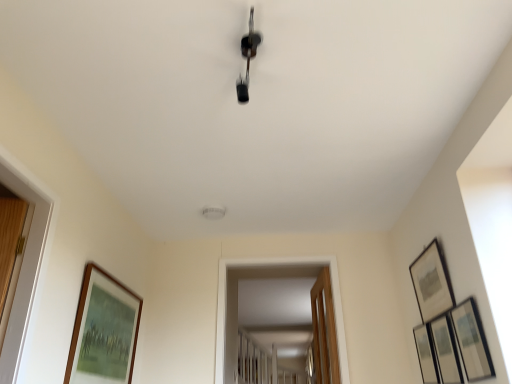
How much space does metallic silver picture frame at right, the first picture frame from the right, occupy horizontally?

The width of metallic silver picture frame at right, the first picture frame from the right, is 1.19 inches.

Describe the element at coordinates (103, 330) in the screenshot. Image resolution: width=512 pixels, height=384 pixels. I see `wooden-framed painting at lower left, acting as the 1th picture frame starting from the left` at that location.

I want to click on wooden door at center, so [x=324, y=331].

Locate an element on the screen. The image size is (512, 384). metallic silver picture frame at right, the first picture frame from the right is located at coordinates (426, 354).

Could you tell me if wooden framed picture at right, which is the fourth picture frame from left to right, is facing matte black picture frame at upper right, which appears as the third picture frame when viewed from the left?

No, wooden framed picture at right, which is the fourth picture frame from left to right, does not turn towards matte black picture frame at upper right, which appears as the third picture frame when viewed from the left.

Locate an element on the screen. picture frame that is the 3rd one when counting downward from the matte black picture frame at upper right, which appears as the 3th picture frame when viewed from the right (from the image's perspective) is located at coordinates (446, 350).

Is matte black picture frame at upper right, which appears as the third picture frame when viewed from the left, completely or partially inside wooden framed picture at right, acting as the second picture frame starting from the right?

No, matte black picture frame at upper right, which appears as the third picture frame when viewed from the left, is not a part of wooden framed picture at right, acting as the second picture frame starting from the right.

Is wooden framed picture at right, which is the fourth picture frame from left to right, touching matte black picture frame at upper right, which appears as the 3th picture frame when viewed from the right?

They are not placed beside each other.

Considering the relative sizes of matte black picture frame at right, marked as the 2th picture frame in a left-to-right arrangement, and wooden-framed painting at lower left, acting as the 1th picture frame starting from the left, in the image provided, is matte black picture frame at right, marked as the 2th picture frame in a left-to-right arrangement, taller than wooden-framed painting at lower left, acting as the 1th picture frame starting from the left,?

In fact, matte black picture frame at right, marked as the 2th picture frame in a left-to-right arrangement, may be shorter than wooden-framed painting at lower left, acting as the 1th picture frame starting from the left.

Could you tell me if matte black picture frame at right, marked as the 2th picture frame in a left-to-right arrangement, is facing wooden-framed painting at lower left, the 5th picture frame in the right-to-left sequence?

Yes, matte black picture frame at right, marked as the 2th picture frame in a left-to-right arrangement, is facing wooden-framed painting at lower left, the 5th picture frame in the right-to-left sequence.

From a real-world perspective, between matte black picture frame at right, marked as the 2th picture frame in a left-to-right arrangement, and wooden-framed painting at lower left, the 5th picture frame in the right-to-left sequence, who is vertically lower?

matte black picture frame at right, marked as the 2th picture frame in a left-to-right arrangement, from a real-world perspective.

Can you tell me how much metallic silver picture frame at right, which is the 5th picture frame from left to right, and matte black picture frame at right, marked as the 2th picture frame in a left-to-right arrangement, differ in facing direction?

2.17 degrees separate the facing orientations of metallic silver picture frame at right, which is the 5th picture frame from left to right, and matte black picture frame at right, marked as the 2th picture frame in a left-to-right arrangement.

Considering the positions of point (431, 351) and point (478, 317), is point (431, 351) closer or farther from the camera than point (478, 317)?

Point (431, 351).

Between metallic silver picture frame at right, the first picture frame from the right, and matte black picture frame at right, arranged as the 4th picture frame when viewed from the right, which one is positioned in front?

matte black picture frame at right, arranged as the 4th picture frame when viewed from the right, is more forward.

Between wooden-framed painting at lower left, the 5th picture frame in the right-to-left sequence, and matte black picture frame at upper right, which appears as the third picture frame when viewed from the left, which one appears on the right side from the viewer's perspective?

From the viewer's perspective, matte black picture frame at upper right, which appears as the third picture frame when viewed from the left, appears more on the right side.

Can you confirm if wooden-framed painting at lower left, the 5th picture frame in the right-to-left sequence, is taller than matte black picture frame at upper right, which appears as the third picture frame when viewed from the left?

Correct, wooden-framed painting at lower left, the 5th picture frame in the right-to-left sequence, is much taller as matte black picture frame at upper right, which appears as the third picture frame when viewed from the left.

Does wooden-framed painting at lower left, the 5th picture frame in the right-to-left sequence, have a lesser width compared to matte black picture frame at upper right, which appears as the third picture frame when viewed from the left?

In fact, wooden-framed painting at lower left, the 5th picture frame in the right-to-left sequence, might be wider than matte black picture frame at upper right, which appears as the third picture frame when viewed from the left.

Who is bigger, wooden-framed painting at lower left, acting as the 1th picture frame starting from the left, or matte black picture frame at upper right, which appears as the third picture frame when viewed from the left?

Bigger between the two is wooden-framed painting at lower left, acting as the 1th picture frame starting from the left.

Between matte black picture frame at upper right, which appears as the third picture frame when viewed from the left, and metallic silver picture frame at right, the first picture frame from the right, which one has less height?

metallic silver picture frame at right, the first picture frame from the right, is shorter.

From the image's perspective, which object appears higher, matte black picture frame at upper right, which appears as the third picture frame when viewed from the left, or metallic silver picture frame at right, which is the 5th picture frame from left to right?

From the image's view, matte black picture frame at upper right, which appears as the third picture frame when viewed from the left, is above.

How different are the orientations of matte black picture frame at upper right, which appears as the third picture frame when viewed from the left, and metallic silver picture frame at right, which is the 5th picture frame from left to right, in degrees?

The angular difference between matte black picture frame at upper right, which appears as the third picture frame when viewed from the left, and metallic silver picture frame at right, which is the 5th picture frame from left to right, is 0.0712 degrees.

Is there a large distance between matte black picture frame at upper right, which appears as the third picture frame when viewed from the left, and metallic silver picture frame at right, which is the 5th picture frame from left to right?

Actually, matte black picture frame at upper right, which appears as the third picture frame when viewed from the left, and metallic silver picture frame at right, which is the 5th picture frame from left to right, are a little close together.

From their relative heights in the image, would you say metallic silver picture frame at right, the first picture frame from the right, is taller or shorter than wooden framed picture at right, acting as the second picture frame starting from the right?

metallic silver picture frame at right, the first picture frame from the right, is taller than wooden framed picture at right, acting as the second picture frame starting from the right.

Considering the positions of points (423, 337) and (436, 352), is point (423, 337) closer to camera compared to point (436, 352)?

No, (423, 337) is further to viewer.

Considering the relative sizes of metallic silver picture frame at right, the first picture frame from the right, and wooden framed picture at right, which is the fourth picture frame from left to right, in the image provided, is metallic silver picture frame at right, the first picture frame from the right, smaller than wooden framed picture at right, which is the fourth picture frame from left to right,?

Correct, metallic silver picture frame at right, the first picture frame from the right, occupies less space than wooden framed picture at right, which is the fourth picture frame from left to right.

How much distance is there between metallic silver picture frame at right, the first picture frame from the right, and wooden framed picture at right, acting as the second picture frame starting from the right?

A distance of 6.96 inches exists between metallic silver picture frame at right, the first picture frame from the right, and wooden framed picture at right, acting as the second picture frame starting from the right.

Is point (425, 332) closer or farther from the camera than point (326, 291)?

Point (425, 332) is positioned closer to the camera compared to point (326, 291).

Could you measure the distance between metallic silver picture frame at right, which is the 5th picture frame from left to right, and wooden door at center?

A distance of 29.88 inches exists between metallic silver picture frame at right, which is the 5th picture frame from left to right, and wooden door at center.

What's the angular difference between metallic silver picture frame at right, which is the 5th picture frame from left to right, and wooden door at center's facing directions?

The facing directions of metallic silver picture frame at right, which is the 5th picture frame from left to right, and wooden door at center are 0.55 degrees apart.

From their relative heights in the image, would you say metallic silver picture frame at right, the first picture frame from the right, is taller or shorter than wooden door at center?

Clearly, metallic silver picture frame at right, the first picture frame from the right, is shorter compared to wooden door at center.

Identify the location of picture frame that is the 4th one below the matte black picture frame at upper right, which appears as the 3th picture frame when viewed from the right (from a real-world perspective). Image resolution: width=512 pixels, height=384 pixels. click(x=446, y=350).

From a real-world perspective, starting from the matte black picture frame at right, arranged as the 4th picture frame when viewed from the right, which picture frame is the 2nd one vertically above it? Please provide its 2D coordinates.

[(103, 330)]

Considering their positions, is wooden framed picture at right, which is the fourth picture frame from left to right, positioned further to wooden door at center than matte black picture frame at upper right, which appears as the 3th picture frame when viewed from the right?

Based on the image, wooden framed picture at right, which is the fourth picture frame from left to right, appears to be further to wooden door at center.

When comparing their distances from wooden-framed painting at lower left, the 5th picture frame in the right-to-left sequence, does matte black picture frame at upper right, which appears as the third picture frame when viewed from the left, or metallic silver picture frame at right, which is the 5th picture frame from left to right, seem further?

metallic silver picture frame at right, which is the 5th picture frame from left to right, lies further to wooden-framed painting at lower left, the 5th picture frame in the right-to-left sequence, than the other object.

Looking at the image, which one is located closer to wooden-framed painting at lower left, acting as the 1th picture frame starting from the left, wooden door at center or matte black picture frame at right, arranged as the 4th picture frame when viewed from the right?

wooden door at center is positioned closer to the anchor wooden-framed painting at lower left, acting as the 1th picture frame starting from the left.

Based on their spatial positions, is matte black picture frame at right, arranged as the 4th picture frame when viewed from the right, or matte black picture frame at upper right, which appears as the 3th picture frame when viewed from the right, further from wooden-framed painting at lower left, acting as the 1th picture frame starting from the left?

The object further to wooden-framed painting at lower left, acting as the 1th picture frame starting from the left, is matte black picture frame at right, arranged as the 4th picture frame when viewed from the right.

Considering their positions, is wooden framed picture at right, acting as the second picture frame starting from the right, positioned further to wooden-framed painting at lower left, the 5th picture frame in the right-to-left sequence, than matte black picture frame at right, arranged as the 4th picture frame when viewed from the right?

matte black picture frame at right, arranged as the 4th picture frame when viewed from the right, is further to wooden-framed painting at lower left, the 5th picture frame in the right-to-left sequence.

Based on their spatial positions, is metallic silver picture frame at right, the first picture frame from the right, or wooden door at center closer to matte black picture frame at right, arranged as the 4th picture frame when viewed from the right?

Based on the image, metallic silver picture frame at right, the first picture frame from the right, appears to be nearer to matte black picture frame at right, arranged as the 4th picture frame when viewed from the right.

Looking at the image, which one is located further to metallic silver picture frame at right, which is the 5th picture frame from left to right, matte black picture frame at upper right, which appears as the third picture frame when viewed from the left, or wooden door at center?

wooden door at center is positioned further to the anchor metallic silver picture frame at right, which is the 5th picture frame from left to right.

Estimate the real-world distances between objects in this image. Which object is further from wooden door at center, matte black picture frame at right, marked as the 2th picture frame in a left-to-right arrangement, or wooden-framed painting at lower left, acting as the 1th picture frame starting from the left?

Based on the image, wooden-framed painting at lower left, acting as the 1th picture frame starting from the left, appears to be further to wooden door at center.

This screenshot has height=384, width=512. I want to click on door between wooden-framed painting at lower left, acting as the 1th picture frame starting from the left, and matte black picture frame at upper right, which appears as the third picture frame when viewed from the left, so pyautogui.click(x=324, y=331).

Locate an element on the screen. picture frame positioned between matte black picture frame at upper right, which appears as the 3th picture frame when viewed from the right, and wooden door at center from near to far is located at coordinates (426, 354).

Identify the location of door located between wooden-framed painting at lower left, the 5th picture frame in the right-to-left sequence, and wooden framed picture at right, which is the fourth picture frame from left to right, in the left-right direction. The image size is (512, 384). (324, 331).

You are a GUI agent. You are given a task and a screenshot of the screen. Output one action in this format:
    pyautogui.click(x=<x>, y=<y>)
    Task: Click on the picture frame between wooden-framed painting at lower left, acting as the 1th picture frame starting from the left, and matte black picture frame at upper right, which appears as the third picture frame when viewed from the left, from left to right
    
    Given the screenshot: What is the action you would take?
    pyautogui.click(x=472, y=341)